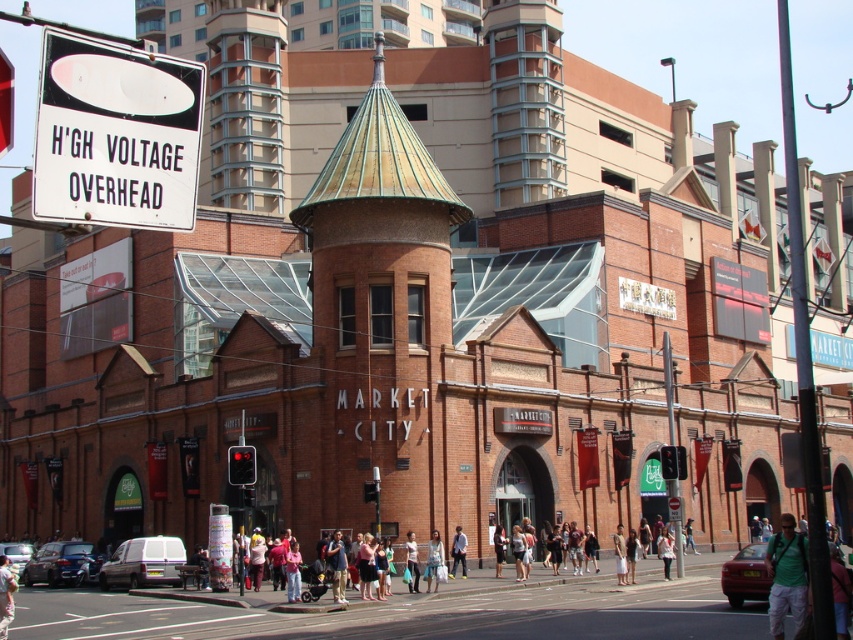
You are standing on the sidewalk in front of Market City and see a green fabric backpack at lower right and a light brown leather jacket at center. Which item is nearer to you?

The green fabric backpack at lower right is closer to the viewer than the light brown leather jacket at center.

You are a photographer wanting to capture both the green fabric backpack at lower right and the light brown leather jacket at center in a single frame. Which object should you zoom in on to ensure both fit in the shot without cropping?

Since the green fabric backpack at lower right is wider than the light brown leather jacket at center, you should zoom in on the light brown leather jacket at center to accommodate the wider backpack in the frame.

You are a photographer standing at the edge of the Market City building. You notice two pairs of light blue jeans in the crowd. One is labeled as light blue denim jeans at center, and the other is light blue jeans at center. Which pair is closer to you?

The light blue denim jeans at center is closer to you since it is only 4.06 meters away from the light blue jeans at center, indicating proximity.